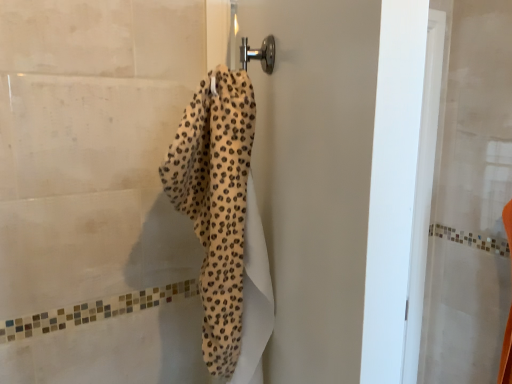
Question: In terms of size, does cheetah print towel at center appear bigger or smaller than leopard print towel at center?

Choices:
 (A) small
 (B) big

Answer: (A)

Question: Is point (238, 340) positioned closer to the camera than point (323, 241)?

Choices:
 (A) farther
 (B) closer

Answer: (A)

Question: Do you think cheetah print towel at center is within leopard print towel at center, or outside of it?

Choices:
 (A) outside
 (B) inside

Answer: (A)

Question: Is leopard print towel at center spatially inside cheetah print towel at center, or outside of it?

Choices:
 (A) outside
 (B) inside

Answer: (A)

Question: From a real-world perspective, is leopard print towel at center physically located above or below cheetah print towel at center?

Choices:
 (A) above
 (B) below

Answer: (B)

Question: From the image's perspective, is leopard print towel at center located above or below cheetah print towel at center?

Choices:
 (A) below
 (B) above

Answer: (A)

Question: In the image, is leopard print towel at center positioned in front of or behind cheetah print towel at center?

Choices:
 (A) behind
 (B) front

Answer: (A)